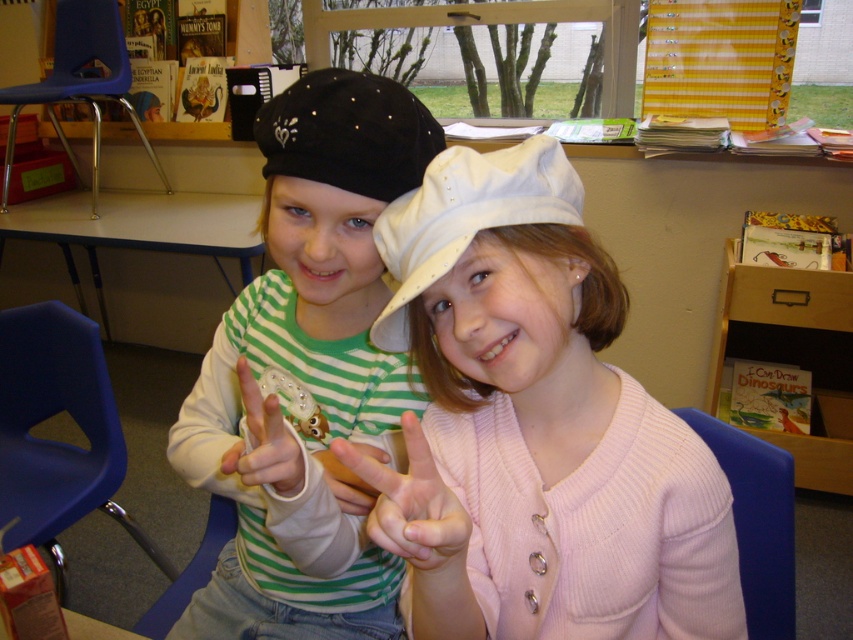
Question: Which object appears farthest from the camera in this image?

Choices:
 (A) white fabric hat at center
 (B) black suede baseball hat at upper center

Answer: (B)

Question: Which point is farther to the camera?

Choices:
 (A) black suede baseball hat at upper center
 (B) matte black hat at center

Answer: (A)

Question: Is black suede baseball hat at upper center to the right of translucent plastic phone at center from the viewer's perspective?

Choices:
 (A) yes
 (B) no

Answer: (A)

Question: Among these points, which one is farthest from the camera?

Choices:
 (A) (410, 497)
 (B) (341, 113)
 (C) (354, 236)
 (D) (283, 464)

Answer: (C)

Question: Is white knit hat at center below black suede baseball hat at upper center?

Choices:
 (A) no
 (B) yes

Answer: (B)

Question: Considering the relative positions of white knit hat at center and pink fabric hand at center in the image provided, where is white knit hat at center located with respect to pink fabric hand at center?

Choices:
 (A) below
 (B) above

Answer: (B)